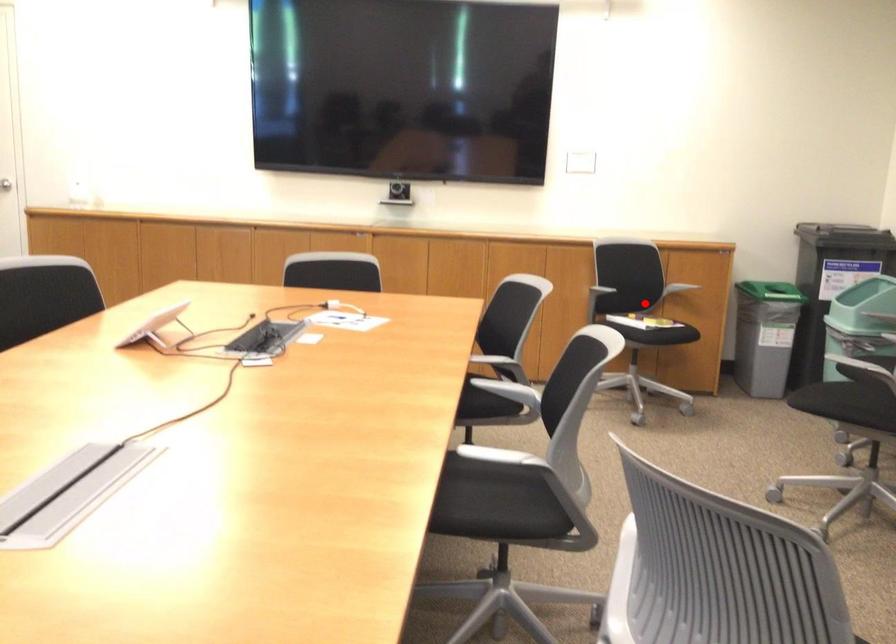
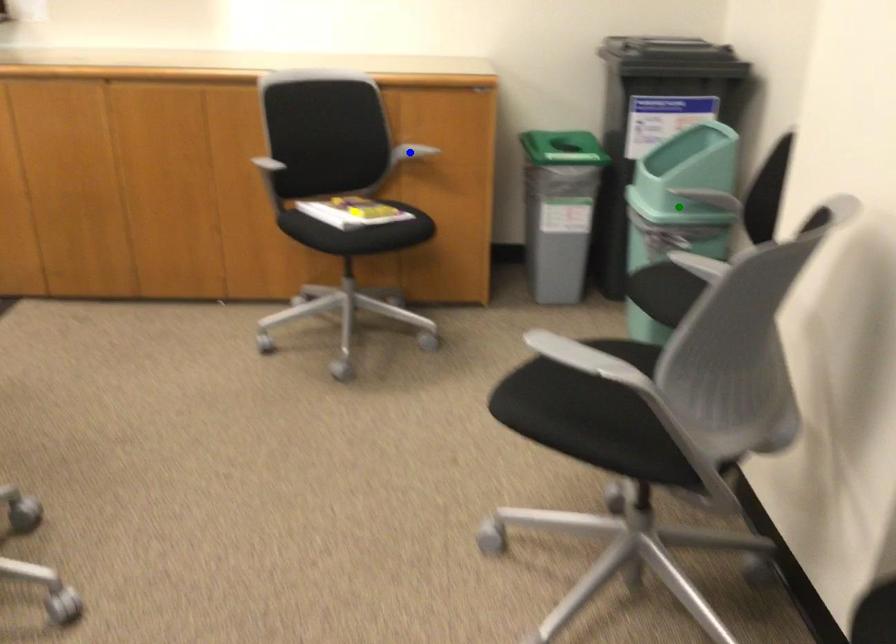
Question: I am providing you with two images of the same scene from different viewpoints. A red point is marked on the first image. You are given multiple points on the second image. In image 2, which mark is for the same physical point as the one in image 1?

Choices:
 (A) blue point
 (B) green point
 (C) yellow point

Answer: (C)